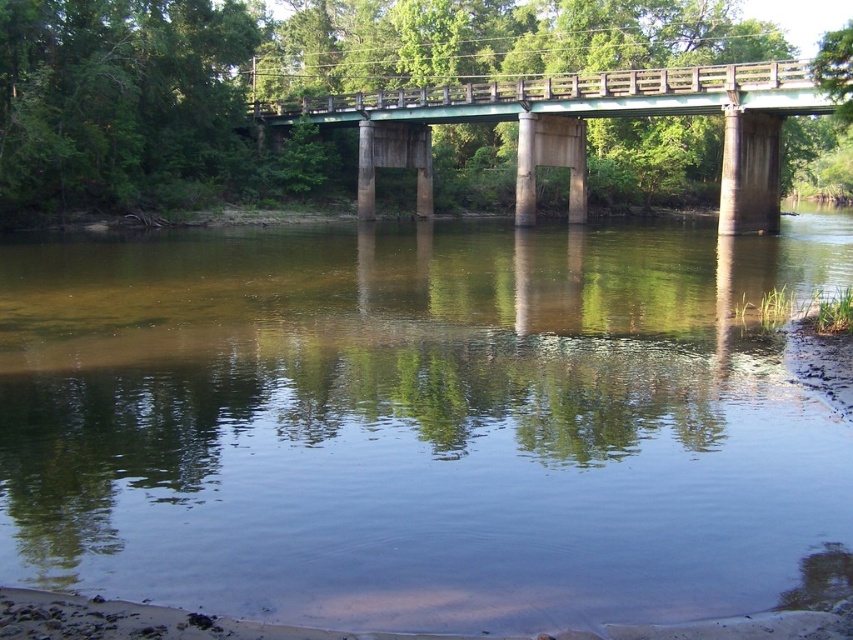
Is point (383, 390) farther from viewer compared to point (260, 120)?

No, it is in front of (260, 120).

Which is below, clear water at center or green concrete bridge at center?

clear water at center

Is point (480, 234) farther from viewer compared to point (387, 112)?

No, (480, 234) is in front of (387, 112).

Where is `clear water at center`? clear water at center is located at coordinates (416, 422).